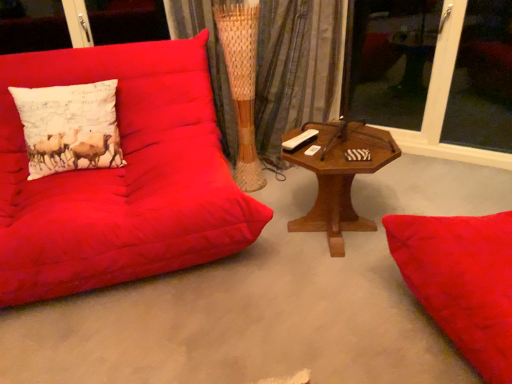
You are a GUI agent. You are given a task and a screenshot of the screen. Output one action in this format:
    pyautogui.click(x=<x>, y=<y>)
    Task: Click on the free space between woodenobject at center and transparent glass window at upper right, which ranks as the 1th window screen in right-to-left order
    This screenshot has width=512, height=384.
    Given the screenshot: What is the action you would take?
    pyautogui.click(x=426, y=182)